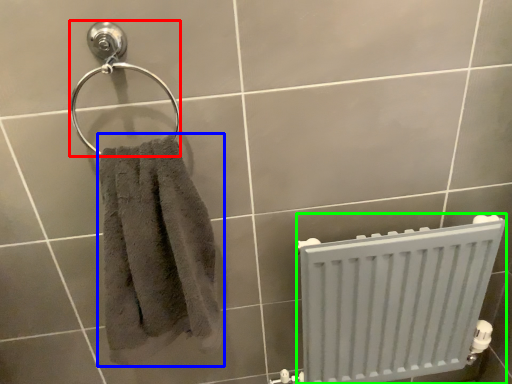
Question: Which object is the farthest from towel bar (highlighted by a red box)? Choose among these: towel (highlighted by a blue box) or radiator (highlighted by a green box).

Choices:
 (A) towel
 (B) radiator

Answer: (B)